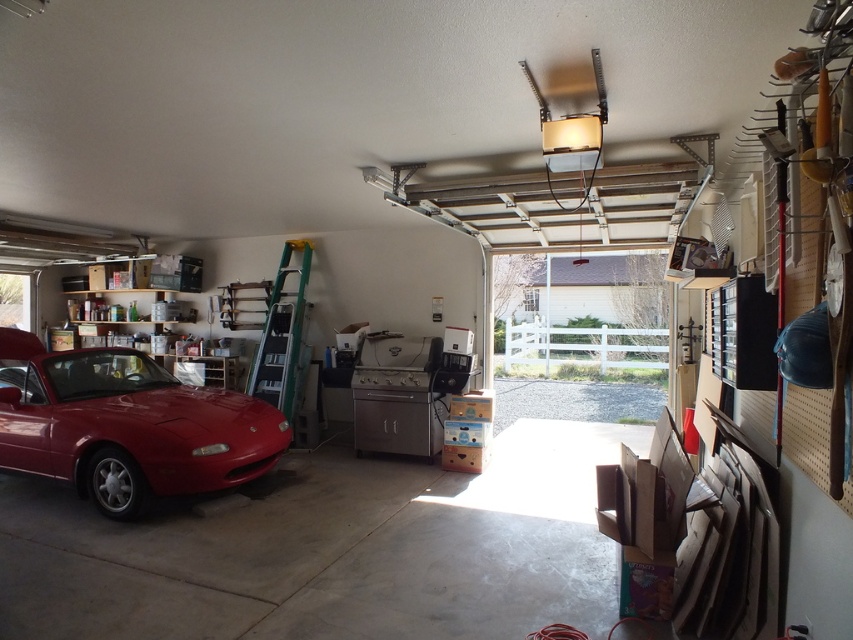
Question: Among these objects, which one is farthest from the camera?

Choices:
 (A) glossy red car at left
 (B) metallic silver ladder at left

Answer: (B)

Question: Does glossy red car at left appear on the right side of metallic silver ladder at left?

Choices:
 (A) no
 (B) yes

Answer: (A)

Question: Does glossy red car at left appear under metallic silver ladder at left?

Choices:
 (A) no
 (B) yes

Answer: (B)

Question: From the image, what is the correct spatial relationship of glossy red car at left in relation to metallic silver ladder at left?

Choices:
 (A) right
 (B) left

Answer: (B)